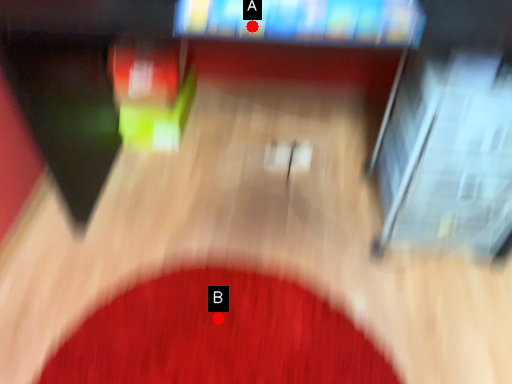
Question: Two points are circled on the image, labeled by A and B beside each circle. Which point is closer to the camera?

Choices:
 (A) A is closer
 (B) B is closer

Answer: (A)